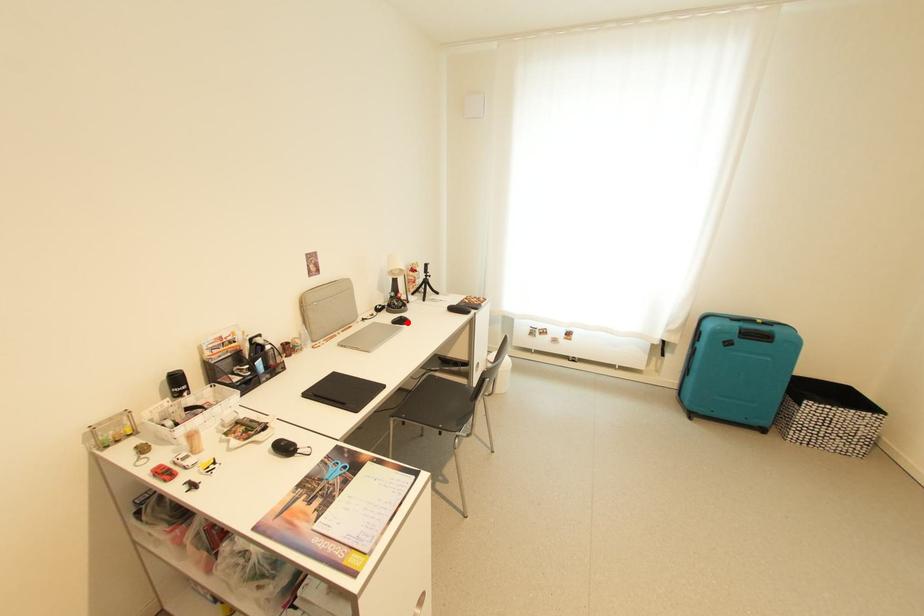
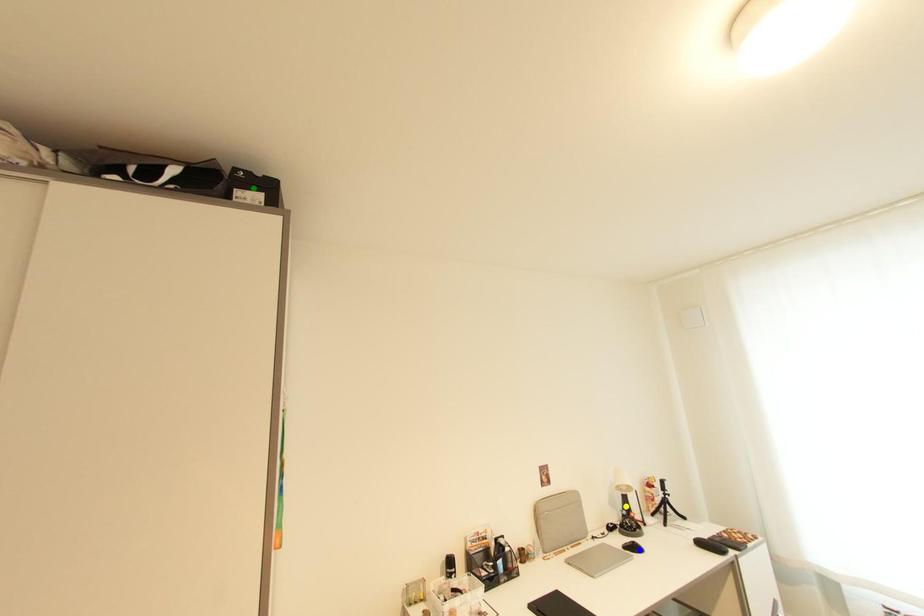
Question: I am providing you with two images of the same scene from different viewpoints. A red point is marked on the first image. You are given multiple points on the second image. Which point in image 2 represents the same 3d spot as the red point in image 1?

Choices:
 (A) blue point
 (B) green point
 (C) yellow point

Answer: (A)